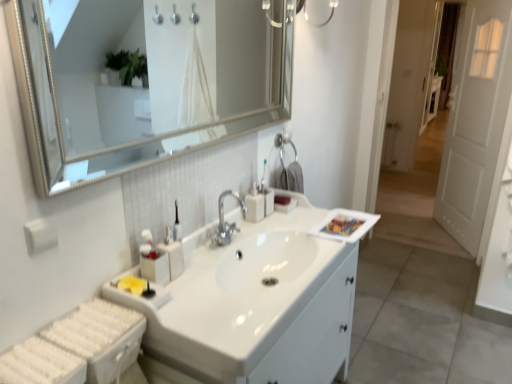
The image size is (512, 384). I want to click on unoccupied space behind white wooden door at right, so click(x=414, y=214).